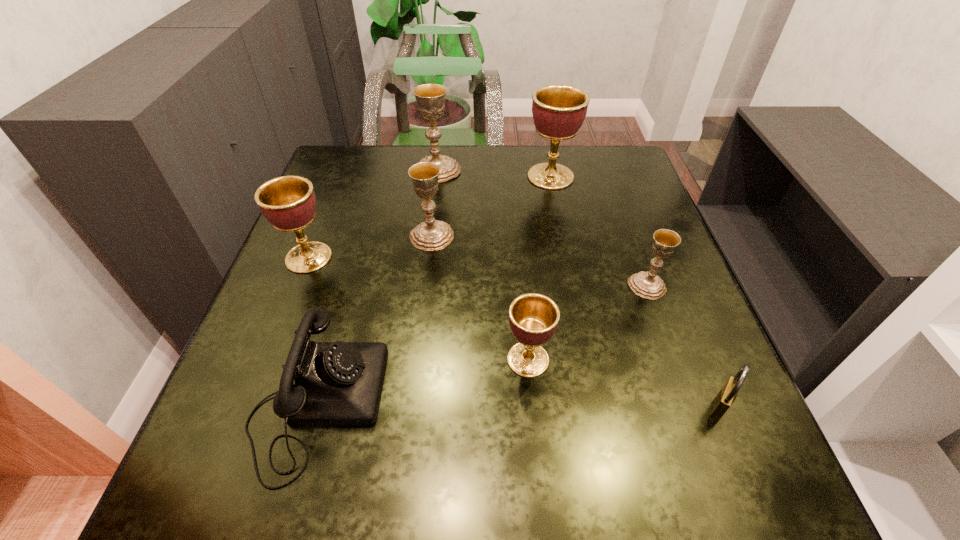
Identify the location of chalice located at the left edge. (288, 202).

Where is `telephone located in the left edge section of the desktop`? telephone located in the left edge section of the desktop is located at coordinates pos(338,383).

What are the coordinates of `chalice at the right edge` in the screenshot? It's located at (648, 284).

Image resolution: width=960 pixels, height=540 pixels. Find the location of `padlock present at the right edge`. padlock present at the right edge is located at coordinates (724, 399).

Where is `object that is positioned at the near left corner`? This screenshot has width=960, height=540. object that is positioned at the near left corner is located at coordinates (338, 383).

Find the location of a particular element. This screenshot has height=540, width=960. vacant space at the far edge of the desktop is located at coordinates (412, 165).

Identify the location of vacant region at the near edge of the desktop. The image size is (960, 540). (466, 491).

Identify the location of vacant region at the left edge. The width and height of the screenshot is (960, 540). (347, 225).

Locate an element on the screen. free location at the right edge of the desktop is located at coordinates (662, 347).

The width and height of the screenshot is (960, 540). In the image, there is a desktop. Identify the location of vacant space at the far right corner. (617, 150).